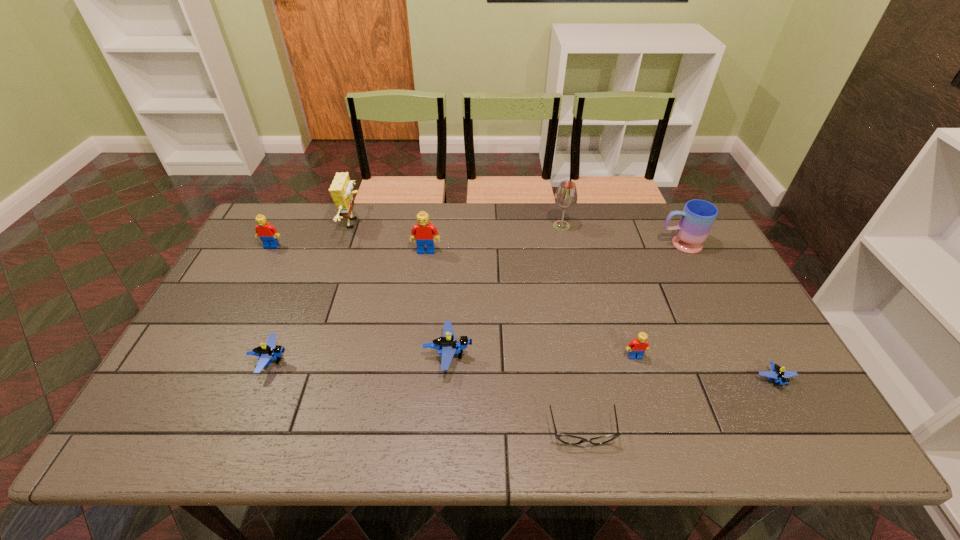
Where is `vacant space situated 0.180m on the side of the mug with the handle`? vacant space situated 0.180m on the side of the mug with the handle is located at coordinates (603, 245).

Where is `free region located on the side of the mug with the handle`? The image size is (960, 540). free region located on the side of the mug with the handle is located at coordinates (585, 245).

The height and width of the screenshot is (540, 960). I want to click on blank space located on the side of the mug with the handle, so click(600, 245).

Locate an element on the screen. vacant region located on the face of the leftmost object is located at coordinates (262, 263).

The width and height of the screenshot is (960, 540). Find the location of `free spot located on the front-facing side of the second blue Lego from left to right`. free spot located on the front-facing side of the second blue Lego from left to right is located at coordinates (617, 355).

I want to click on free location located on the face of the eighth object from left to right, so click(x=649, y=403).

What are the coordinates of `free space located on the front-facing side of the second biggest blue Lego` in the screenshot? It's located at (401, 360).

I want to click on vacant area situated 0.080m on the front-facing side of the shortest Lego, so click(x=799, y=425).

This screenshot has width=960, height=540. What are the coordinates of `sponge at the far edge` in the screenshot? It's located at pos(341,192).

At what (x,y) coordinates should I click in order to perform the action: click on wineglass that is at the far edge. Please return your answer as a coordinate pair (x, y). The height and width of the screenshot is (540, 960). Looking at the image, I should click on (566, 196).